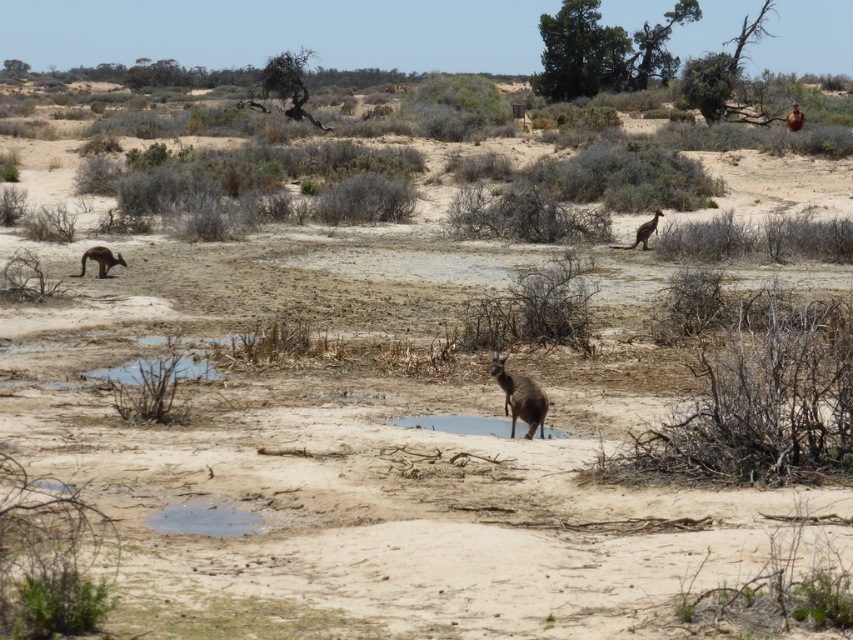
Can you confirm if brown furry kangaroo at center is positioned to the right of clear water at center?

Indeed, brown furry kangaroo at center is positioned on the right side of clear water at center.

In the scene shown: Is brown furry kangaroo at center further to the viewer compared to clear water at center?

No, it is in front of clear water at center.

Measure the distance between brown furry kangaroo at center and camera.

brown furry kangaroo at center and camera are 10.13 meters apart.

At what (x,y) coordinates should I click in order to perform the action: click on brown furry kangaroo at center. Please return your answer as a coordinate pair (x, y). The image size is (853, 640). Looking at the image, I should click on (519, 396).

What do you see at coordinates (462, 424) in the screenshot? This screenshot has width=853, height=640. I see `clear water at center` at bounding box center [462, 424].

Between clear water at center and brown fur kangaroo at left, which one has less height?

clear water at center is shorter.

The image size is (853, 640). What are the coordinates of `clear water at center` in the screenshot? It's located at (462, 424).

From the picture: Which is above, brown fur kangaroo at left or brown fur kangaroo at upper right?

Positioned higher is brown fur kangaroo at upper right.

Is brown fur kangaroo at left wider than brown fur kangaroo at upper right?

No, brown fur kangaroo at left is not wider than brown fur kangaroo at upper right.

Which is in front, point (107, 259) or point (645, 246)?

Positioned in front is point (107, 259).

Image resolution: width=853 pixels, height=640 pixels. Identify the location of brown fur kangaroo at left. (99, 260).